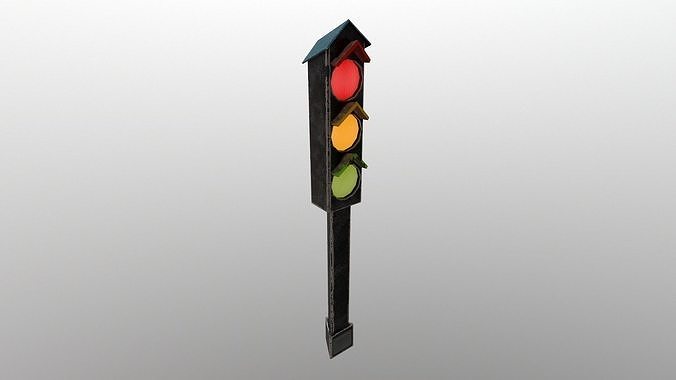
Find the location of a particular element. green light is located at coordinates (347, 183).